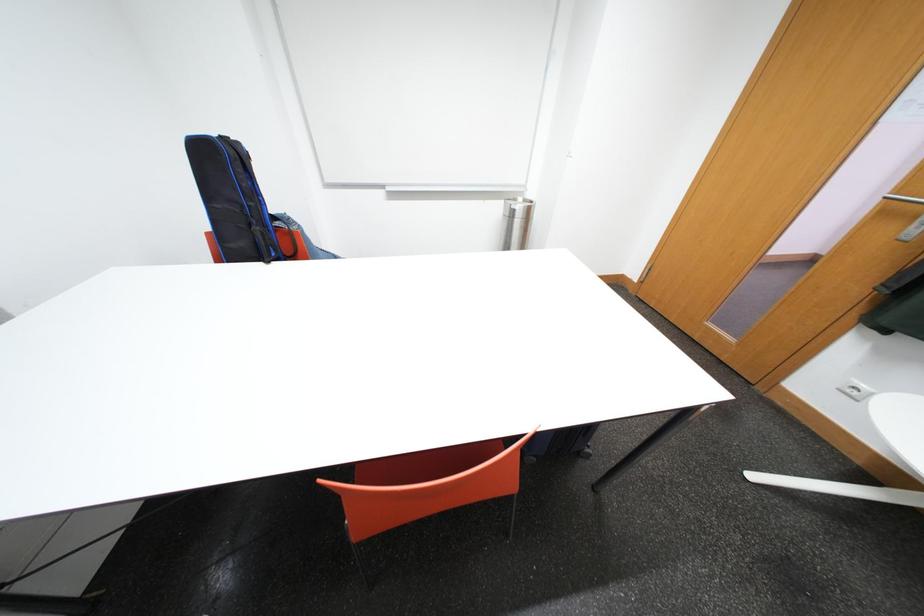
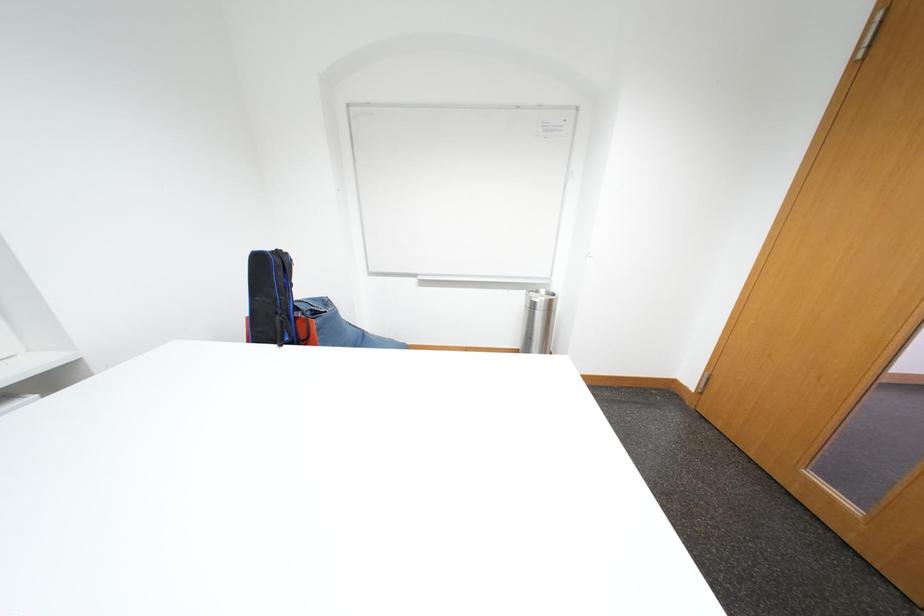
Question: Which direction would the cameraman need to move to produce the second image? Reply with the corresponding letter.

Choices:
 (A) Left
 (B) Right
 (C) Forward
 (D) Backward

Answer: (B)